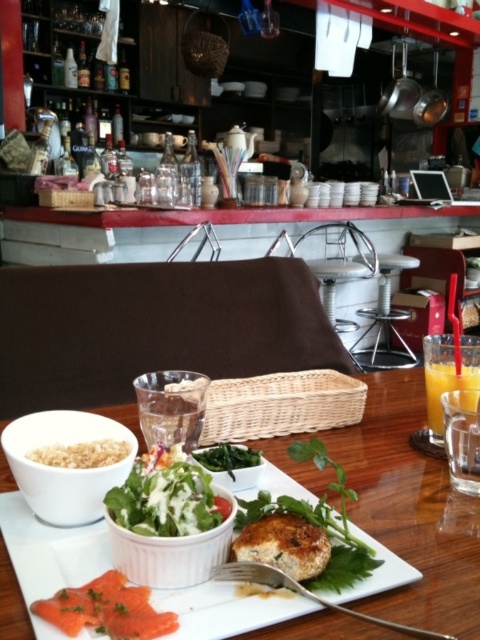
Which is behind, point (211, 508) or point (139, 570)?

The point (211, 508) is more distant.

Who is shorter, green leafy salad at center or white ceramic bowl at center?

green leafy salad at center is shorter.

At what (x,y) coordinates should I click in order to perform the action: click on green leafy salad at center. Please return your answer as a coordinate pair (x, y). Looking at the image, I should click on (166, 497).

Does translucent glass of orange juice at right have a greater height compared to green leafy vegetable at center?

Yes.

Does point (471, 388) lie in front of point (216, 476)?

No, it is not.

Locate an element on the screen. translucent glass of orange juice at right is located at coordinates (445, 387).

Which is behind, point (384, 372) or point (48, 440)?

Point (384, 372)

Identify the location of white ceramic plate at center. (402, 504).

Where is `white ceramic plate at center`? This screenshot has height=640, width=480. white ceramic plate at center is located at coordinates (402, 504).